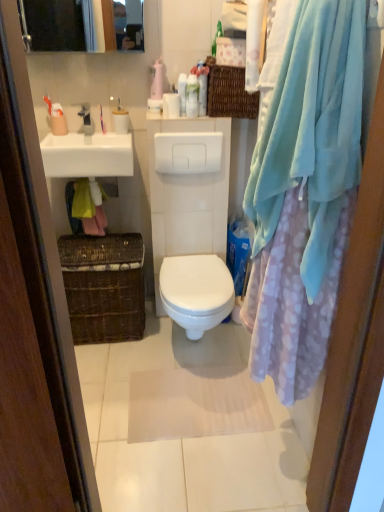
The image size is (384, 512). I want to click on vacant region under matte white medicine cabinet at upper left (from a real-world perspective), so click(98, 135).